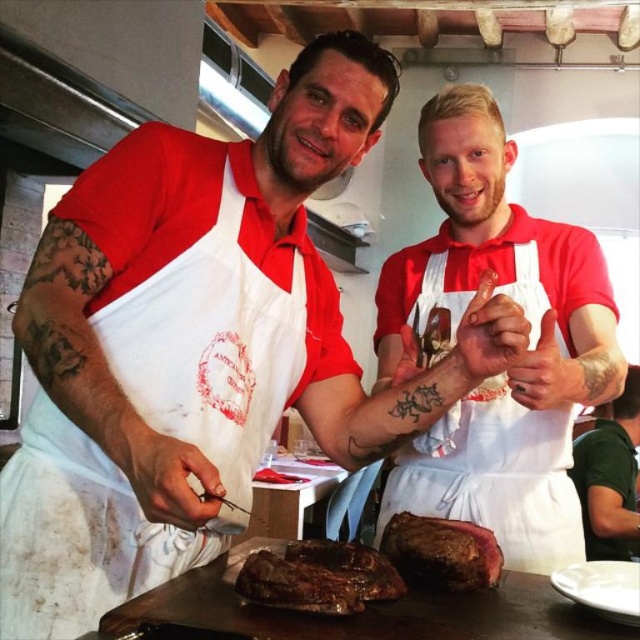
You are a customer at a food stall and see two staff members wearing white apron at center and white cotton apron at center. Which apron reaches higher up the body?

The white apron at center has a greater height compared to the white cotton apron at center, so the white apron at center reaches higher up the body.

In the scene shown: You are a customer at a food stall and see two staff members wearing white apron at center. You need to approach one of them for assistance. Which staff member is closer to you?

The staff member closer to you is the one with the tattooed arm holding a small object, as they are 90.11 centimeters closer than the other staff member.